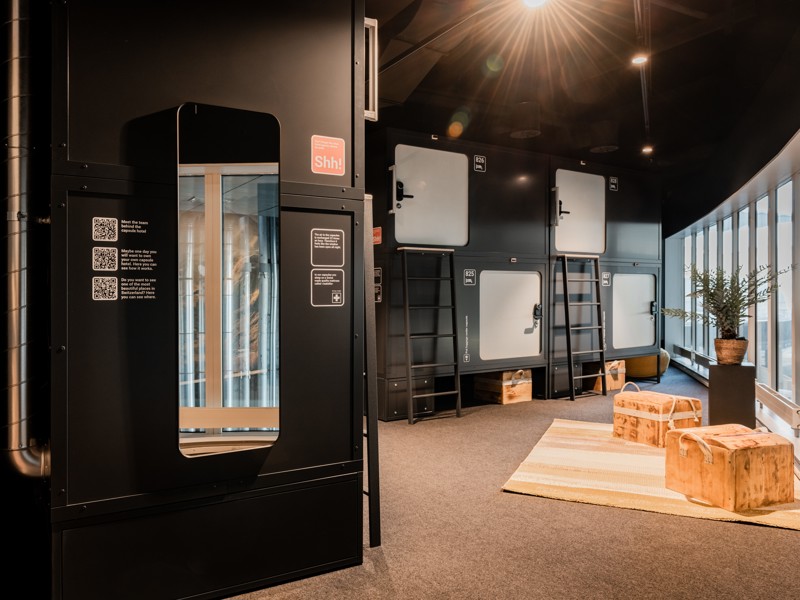
Identify the location of handle. (674, 403), (626, 385), (700, 444), (760, 431), (614, 366), (518, 376).